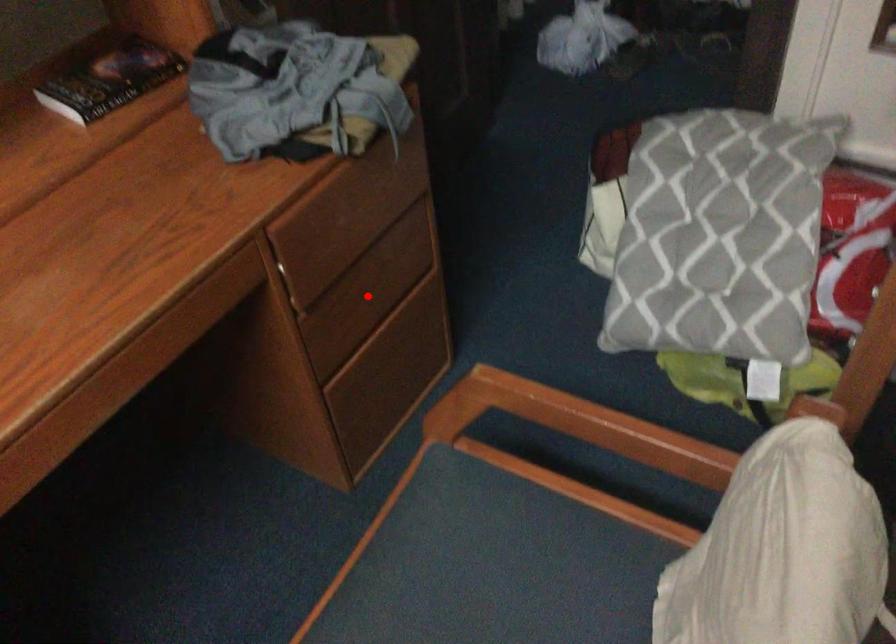
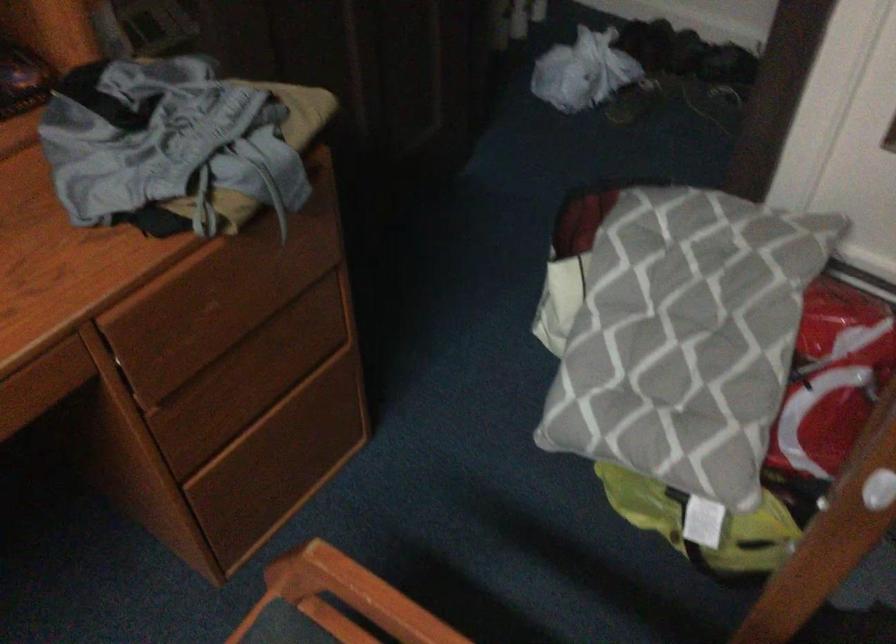
Find the pixel in the second image that matches the highlighted location in the first image.

(254, 377)